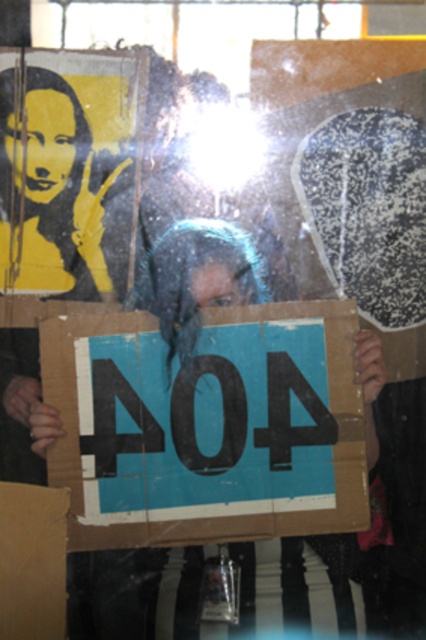
Which of these two, blue cardboard sign at center or brown cardboard at lower left, stands taller?

blue cardboard sign at center

Who is more distant from viewer, (x=46, y=332) or (x=57, y=609)?

The point (x=46, y=332) is more distant.

Where is `blue cardboard sign at center`? This screenshot has height=640, width=426. blue cardboard sign at center is located at coordinates (207, 426).